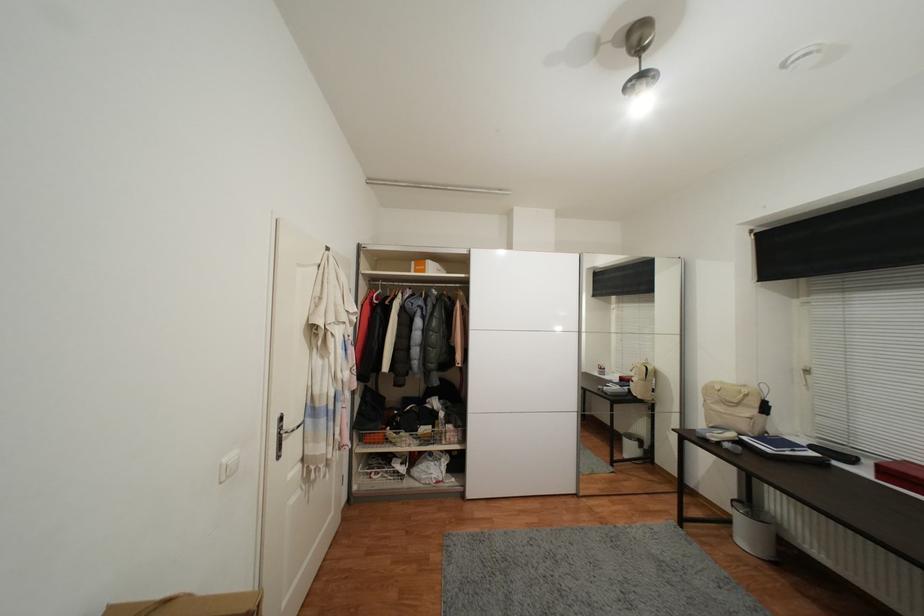
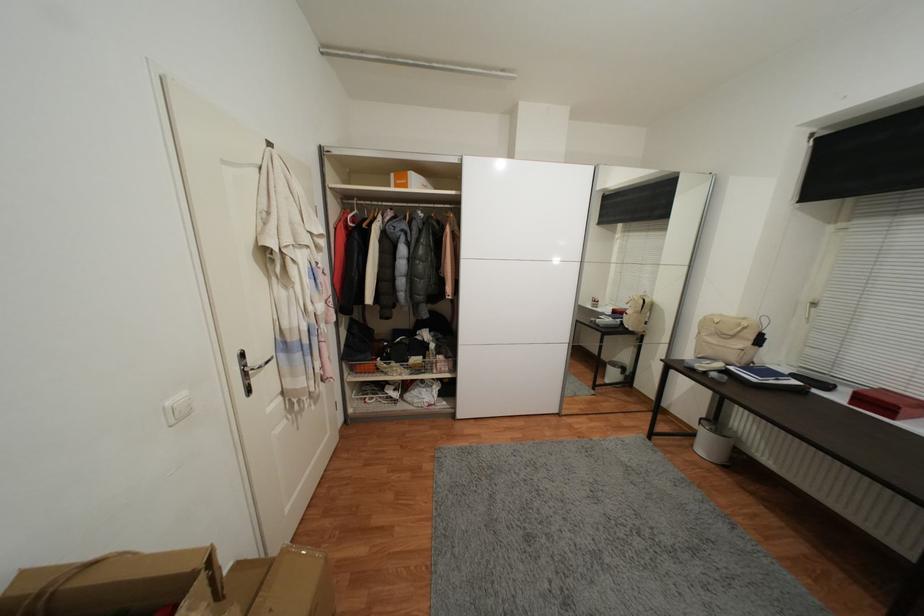
Locate, in the second image, the point that corresponds to (x=405, y=462) in the first image.

(397, 389)